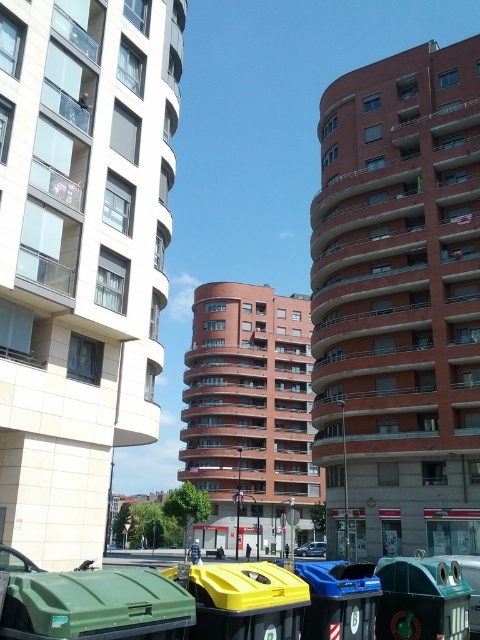
Question: Which of the following is the farthest from the observer?

Choices:
 (A) (300, 616)
 (B) (463, 611)

Answer: (B)

Question: Does green plastic recycling bin at lower right have a larger size compared to blue plastic recycling bin at lower right?

Choices:
 (A) no
 (B) yes

Answer: (A)

Question: Is green plastic bin at lower left bigger than blue plastic recycling bin at lower right?

Choices:
 (A) no
 (B) yes

Answer: (A)

Question: From the image, what is the correct spatial relationship of yellow plastic bin at lower center in relation to green plastic recycling bin at lower right?

Choices:
 (A) left
 (B) right

Answer: (A)

Question: Which object appears farthest from the camera in this image?

Choices:
 (A) yellow plastic bin at lower center
 (B) green plastic recycling bin at lower right

Answer: (B)

Question: Which point is farther from the camera taking this photo?

Choices:
 (A) (137, 632)
 (B) (356, 620)
 (C) (260, 636)

Answer: (B)